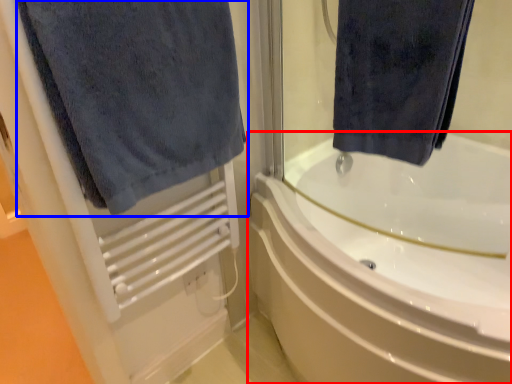
Question: Among these objects, which one is nearest to the camera, bathtub (highlighted by a red box) or towel (highlighted by a blue box)?

Choices:
 (A) bathtub
 (B) towel

Answer: (B)